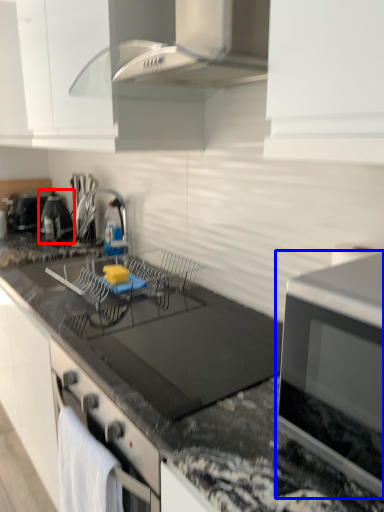
Question: Among these objects, which one is farthest to the camera, appliance (highlighted by a red box) or kitchen appliance (highlighted by a blue box)?

Choices:
 (A) appliance
 (B) kitchen appliance

Answer: (A)